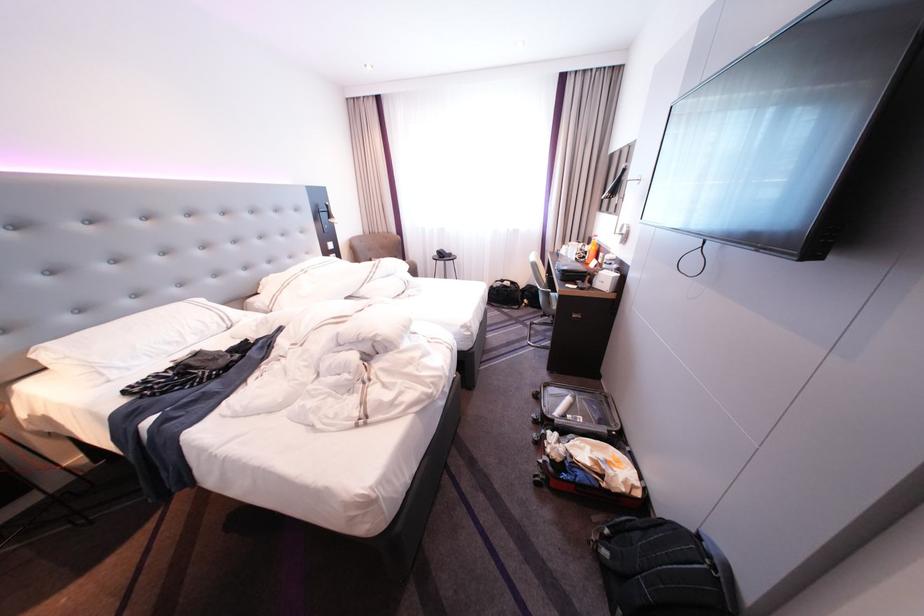
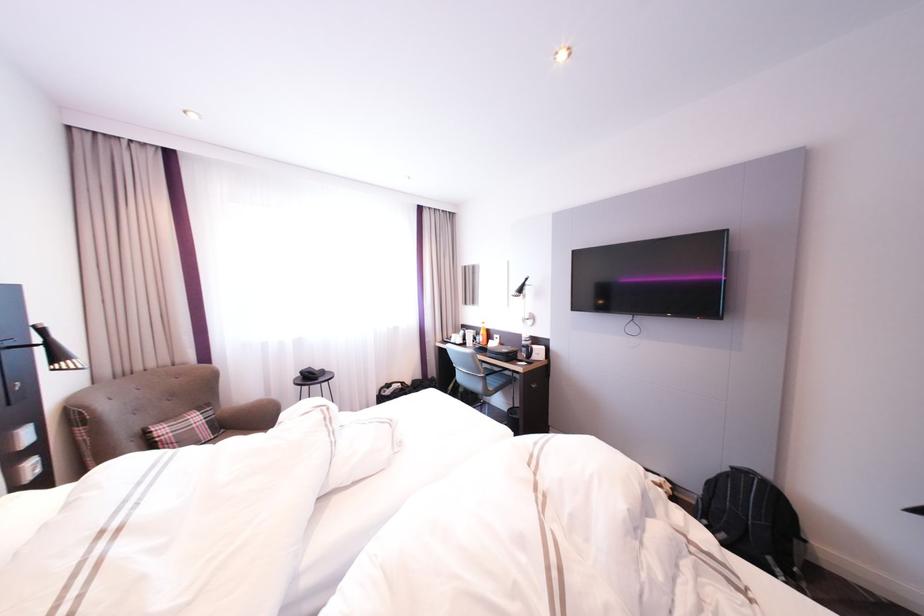
In the second image, find the point that corresponds to pixel 515 282 in the first image.

(400, 386)